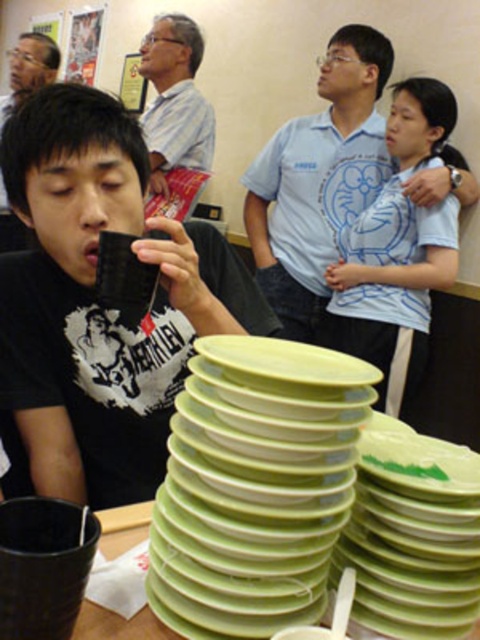
Question: Can you confirm if green plastic plates at center is smaller than light blue printed shirt at upper center?

Choices:
 (A) yes
 (B) no

Answer: (A)

Question: Does green plastic plates at center come in front of light blue printed shirt at upper center?

Choices:
 (A) no
 (B) yes

Answer: (B)

Question: Which point is farther to the camera?

Choices:
 (A) matte black mug at left
 (B) green plastic plates at lower center
 (C) green matte plate at center

Answer: (A)

Question: Based on their relative distances, which object is farther from the black matte cup at lower left?

Choices:
 (A) green plastic plates at center
 (B) light blue printed shirt at upper center

Answer: (B)

Question: Considering the real-world distances, which object is closest to the matte black mug at left?

Choices:
 (A) green matte plate at center
 (B) light blue printed shirt at upper center

Answer: (A)

Question: Can you confirm if matte black mug at left is positioned to the right of green plastic plates at lower center?

Choices:
 (A) yes
 (B) no

Answer: (B)